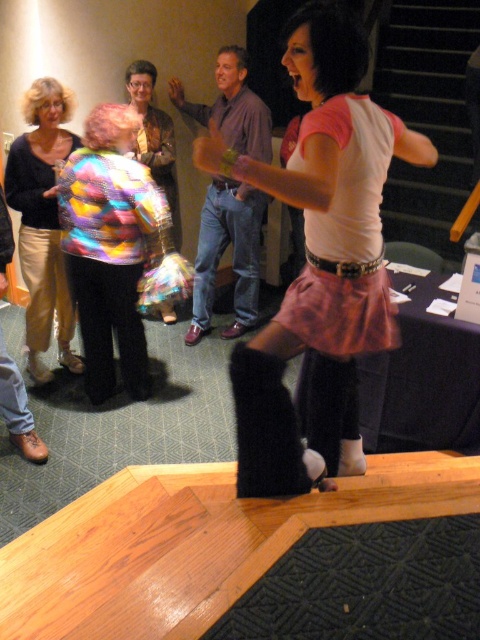
Does pink fabric skirt at center appear on the right side of multicolored fabric jacket at center?

Correct, you'll find pink fabric skirt at center to the right of multicolored fabric jacket at center.

This screenshot has width=480, height=640. Identify the location of pink fabric skirt at center. pos(316,241).

Which is behind, point (239, 419) or point (140, 220)?

Positioned behind is point (140, 220).

The image size is (480, 640). I want to click on pink fabric skirt at center, so click(316, 241).

You are a GUI agent. You are given a task and a screenshot of the screen. Output one action in this format:
    pyautogui.click(x=<x>, y=<y>)
    Task: Click on the pink fabric skirt at center
    Image resolution: width=480 pixels, height=640 pixels.
    Given the screenshot: What is the action you would take?
    pyautogui.click(x=316, y=241)

Is pink fabric skirt at center below matte black sweater at left?

Yes.

Locate an element on the screen. This screenshot has height=640, width=480. pink fabric skirt at center is located at coordinates (316, 241).

Is matte black sweater at left bigger than rainbow sequined jacket at center?

Yes.

Is point (48, 138) positioned after point (129, 74)?

No, (48, 138) is closer to viewer.

You are a GUI agent. You are given a task and a screenshot of the screen. Output one action in this format:
    pyautogui.click(x=<x>, y=<y>)
    Task: Click on the matte black sweater at left
    Image resolution: width=480 pixels, height=640 pixels.
    Given the screenshot: What is the action you would take?
    pyautogui.click(x=43, y=221)